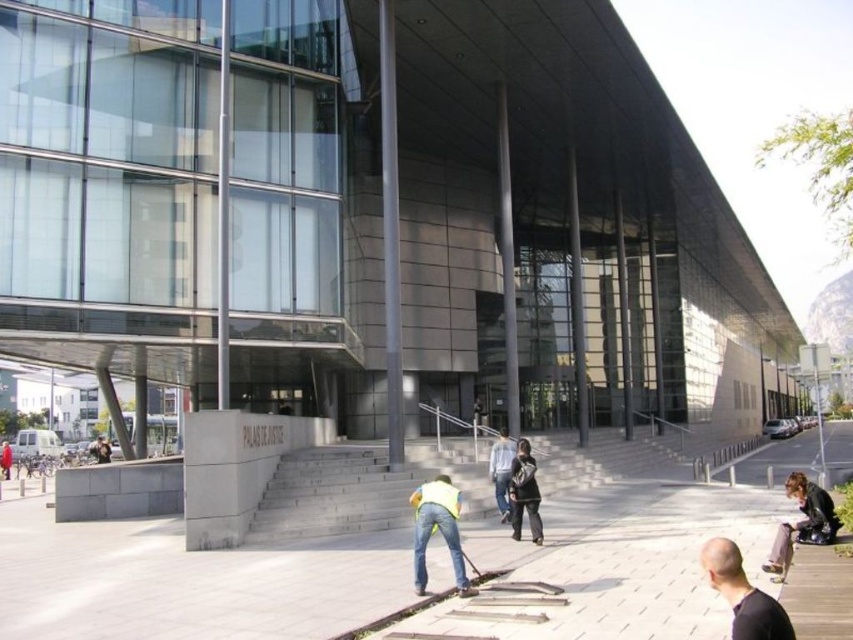
Can you confirm if gray concrete stairs at center is positioned below light blue jeans at center?

Correct, gray concrete stairs at center is located below light blue jeans at center.

Which is behind, point (670, 464) or point (503, 445)?

The point (670, 464) is behind.

Measure the distance between gray concrete stairs at center and camera.

The distance of gray concrete stairs at center from camera is 11.19 meters.

Identify the location of gray concrete stairs at center. (361, 488).

Which is more to the right, gray concrete stairs at center or yellow reflective vest at lower center?

gray concrete stairs at center is more to the right.

Is the position of gray concrete stairs at center less distant than that of yellow reflective vest at lower center?

That is False.

Is point (645, 436) more distant than point (426, 490)?

Yes.

I want to click on gray concrete stairs at center, so click(361, 488).

Is yellow reflective vest at lower center behind dark gray fabric jacket at center?

No, it is in front of dark gray fabric jacket at center.

Find the location of a particular element. This screenshot has width=853, height=640. yellow reflective vest at lower center is located at coordinates (437, 529).